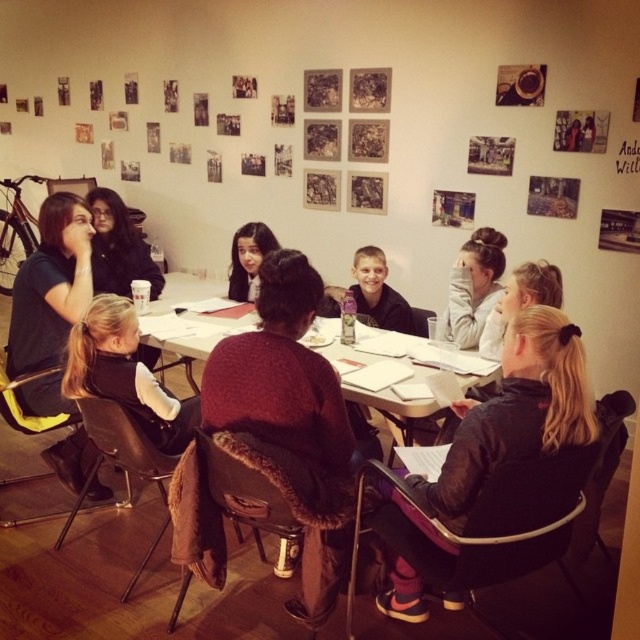
Is point (448, 557) in front of point (385, 304)?

That is True.

Which is behind, point (522, 413) or point (353, 257)?

Point (353, 257)

This screenshot has height=640, width=640. Identify the location of black fleece jacket at lower right. (516, 412).

Is point (512, 371) behind point (372, 397)?

No, (512, 371) is closer to viewer.

Does black fleece jacket at lower right appear on the right side of white paper at center?

Correct, you'll find black fleece jacket at lower right to the right of white paper at center.

Identify the location of black fleece jacket at lower right. The height and width of the screenshot is (640, 640). (516, 412).

Between smooth skin boy at center and matte black hair at center, which one is positioned lower?

smooth skin boy at center is lower down.

Is point (360, 275) positioned after point (228, 291)?

No, (360, 275) is closer to viewer.

Between point (396, 326) and point (234, 266), which one is positioned behind?

The point (234, 266) is more distant.

Where is `smooth skin boy at center`? This screenshot has height=640, width=640. smooth skin boy at center is located at coordinates point(378,292).